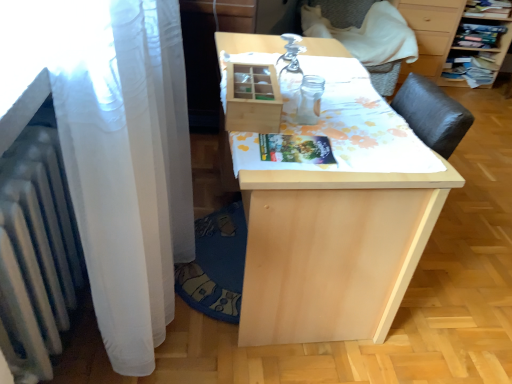
The width and height of the screenshot is (512, 384). Describe the element at coordinates (383, 42) in the screenshot. I see `gray fabric armchair at upper right` at that location.

The height and width of the screenshot is (384, 512). Identify the location of natural wood table at center. (333, 250).

The width and height of the screenshot is (512, 384). What do you see at coordinates (333, 250) in the screenshot?
I see `natural wood table at center` at bounding box center [333, 250].

Locate an element on the screen. wooden drawer at upper right is located at coordinates (431, 34).

Considering the positions of points (336, 191) and (19, 163), is point (336, 191) closer to camera compared to point (19, 163)?

No, it is not.

From the picture: From the image's perspective, between natural wood table at center and white metallic radiator at left, who is located below?

From the image's view, white metallic radiator at left is below.

In the scene shown: Measure the distance between natural wood table at center and white metallic radiator at left.

natural wood table at center is 25.73 inches away from white metallic radiator at left.

Considering the relative sizes of natural wood table at center and white metallic radiator at left in the image provided, is natural wood table at center bigger than white metallic radiator at left?

Yes, natural wood table at center is bigger than white metallic radiator at left.

Can you confirm if wooden drawer at upper right is taller than white metallic radiator at left?

Yes.

What's the angular difference between wooden drawer at upper right and white metallic radiator at left's facing directions?

89.5 degrees.

Are wooden drawer at upper right and white metallic radiator at left beside each other?

No, wooden drawer at upper right is not next to white metallic radiator at left.

Considering the sizes of objects wooden drawer at upper right and white metallic radiator at left in the image provided, who is thinner, wooden drawer at upper right or white metallic radiator at left?

With smaller width is white metallic radiator at left.

From the image's perspective, between natural wood table at center and wooden drawer at upper right, which one is located above?

wooden drawer at upper right is shown above in the image.

Does natural wood table at center appear on the right side of wooden drawer at upper right?

No, natural wood table at center is not to the right of wooden drawer at upper right.

Looking at the image, does natural wood table at center seem bigger or smaller compared to wooden drawer at upper right?

Considering their sizes, natural wood table at center takes up more space than wooden drawer at upper right.

Is natural wood table at center further to camera compared to wooden drawer at upper right?

No, it is not.

From a real-world perspective, who is located higher, gray fabric armchair at upper right or white metallic radiator at left?

white metallic radiator at left is physically above.

From the image's perspective, is gray fabric armchair at upper right on white metallic radiator at left?

Yes, from the image's perspective, gray fabric armchair at upper right is on top of white metallic radiator at left.

Which is behind, point (377, 3) or point (36, 256)?

The point (377, 3) is farther from the camera.

Are gray fabric armchair at upper right and white metallic radiator at left making contact?

No.

Choose the correct answer: Is gray fabric armchair at upper right inside natural wood table at center or outside it?

gray fabric armchair at upper right is spatially situated outside natural wood table at center.

Would you say gray fabric armchair at upper right is a long distance from natural wood table at center?

Yes, gray fabric armchair at upper right and natural wood table at center are quite far apart.

Is gray fabric armchair at upper right taller or shorter than natural wood table at center?

In the image, gray fabric armchair at upper right appears to be taller than natural wood table at center.

Looking at this image, from a real-world perspective, is natural wood table at center on top of gray fabric armchair at upper right?

No, from a real-world perspective, natural wood table at center is not above gray fabric armchair at upper right.

What's the angular difference between natural wood table at center and gray fabric armchair at upper right's facing directions?

They differ by 91.8 degrees in their facing directions.

Considering the sizes of natural wood table at center and gray fabric armchair at upper right in the image, is natural wood table at center taller or shorter than gray fabric armchair at upper right?

Considering their sizes, natural wood table at center has less height than gray fabric armchair at upper right.

Can you confirm if natural wood table at center is bigger than gray fabric armchair at upper right?

Correct, natural wood table at center is larger in size than gray fabric armchair at upper right.

From the image's perspective, which is above, white metallic radiator at left or natural wood table at center?

From the image's view, natural wood table at center is above.

Considering the sizes of white metallic radiator at left and natural wood table at center in the image, is white metallic radiator at left bigger or smaller than natural wood table at center?

Considering their sizes, white metallic radiator at left takes up less space than natural wood table at center.

I want to click on radiator that is on the left side of natural wood table at center, so click(36, 252).

Is white metallic radiator at left next to natural wood table at center?

No, white metallic radiator at left is not in contact with natural wood table at center.

What are the coordinates of `radiator that appears in front of the natural wood table at center` in the screenshot? It's located at (36, 252).

You are a GUI agent. You are given a task and a screenshot of the screen. Output one action in this format:
    pyautogui.click(x=<x>, y=<y>)
    Task: Click on the radiator located above the wooden drawer at upper right (from a real-world perspective)
    This screenshot has height=384, width=512.
    Given the screenshot: What is the action you would take?
    pyautogui.click(x=36, y=252)

When comparing their distances from wooden drawer at upper right, does white metallic radiator at left or gray fabric armchair at upper right seem further?

white metallic radiator at left is positioned further to the anchor wooden drawer at upper right.

From the image, which object appears to be nearer to white metallic radiator at left, wooden drawer at upper right or gray fabric armchair at upper right?

gray fabric armchair at upper right lies closer to white metallic radiator at left than the other object.

In the scene shown: Based on their spatial positions, is gray fabric armchair at upper right or natural wood table at center further from white metallic radiator at left?

gray fabric armchair at upper right.

Looking at the image, which one is located further to white metallic radiator at left, gray fabric armchair at upper right or wooden drawer at upper right?

wooden drawer at upper right is positioned further to the anchor white metallic radiator at left.

When comparing their distances from gray fabric armchair at upper right, does natural wood table at center or wooden drawer at upper right seem further?

natural wood table at center is positioned further to the anchor gray fabric armchair at upper right.

Consider the image. Based on their spatial positions, is natural wood table at center or white metallic radiator at left further from gray fabric armchair at upper right?

Among the two, white metallic radiator at left is located further to gray fabric armchair at upper right.

Considering their positions, is wooden drawer at upper right positioned closer to natural wood table at center than white metallic radiator at left?

white metallic radiator at left is positioned closer to the anchor natural wood table at center.

Estimate the real-world distances between objects in this image. Which object is further from natural wood table at center, gray fabric armchair at upper right or white metallic radiator at left?

The object further to natural wood table at center is gray fabric armchair at upper right.

This screenshot has height=384, width=512. Identify the location of armchair between white metallic radiator at left and wooden drawer at upper right along the z-axis. (383, 42).

Identify the location of table between white metallic radiator at left and wooden drawer at upper right from front to back. (333, 250).

Locate an element on the screen. This screenshot has width=512, height=384. armchair between natural wood table at center and wooden drawer at upper right from front to back is located at coordinates (383, 42).

In order to click on table between white metallic radiator at left and gray fabric armchair at upper right in the front-back direction in this screenshot , I will do click(x=333, y=250).